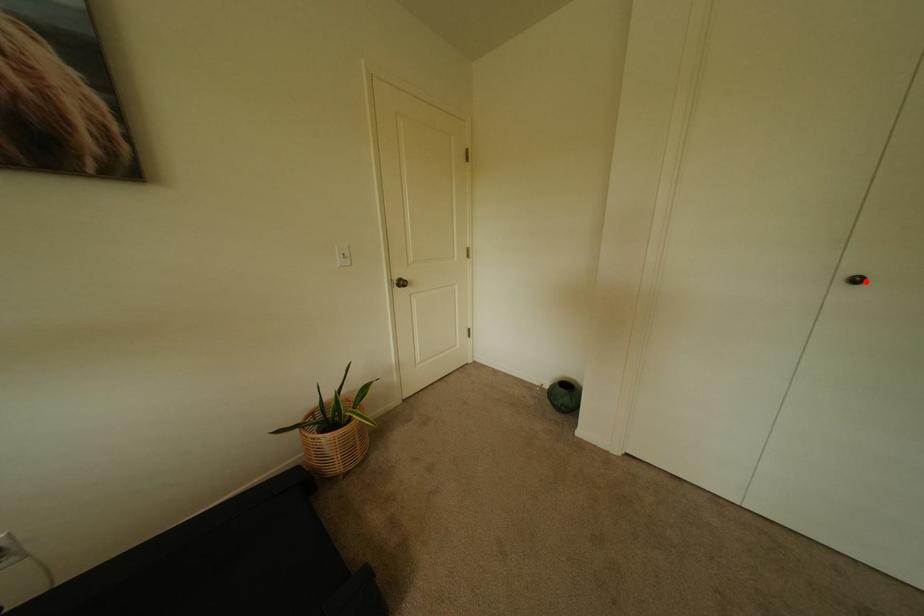
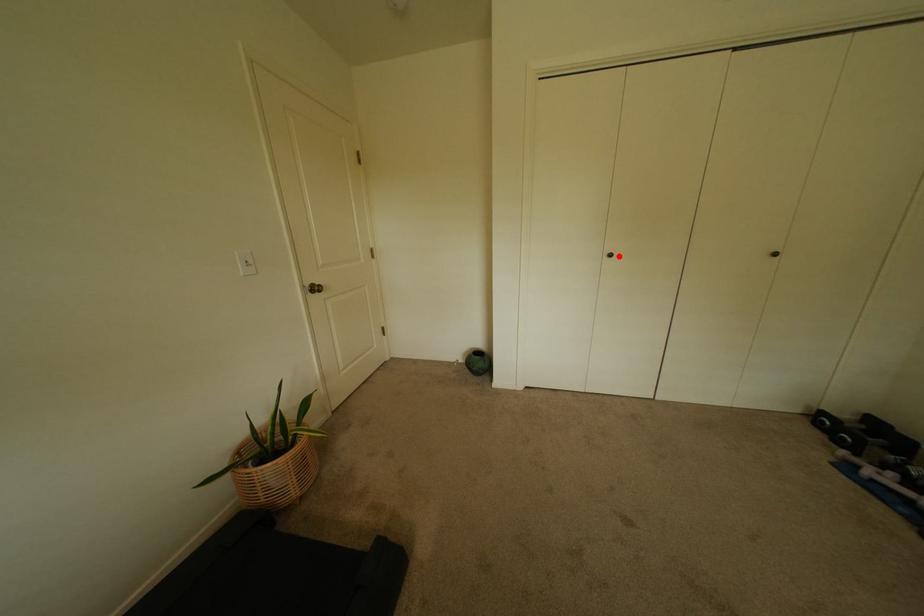
I am providing you with two images of the same scene from different viewpoints. A red point is marked on the first image and another point is marked on the second image. Are the points marked in image1 and image2 representing the same 3D position?

Yes